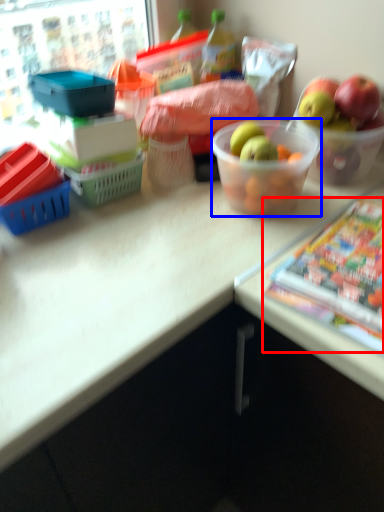
Question: Which object appears farthest to the camera in this image, comic book (highlighted by a red box) or bowl (highlighted by a blue box)?

Choices:
 (A) comic book
 (B) bowl

Answer: (B)